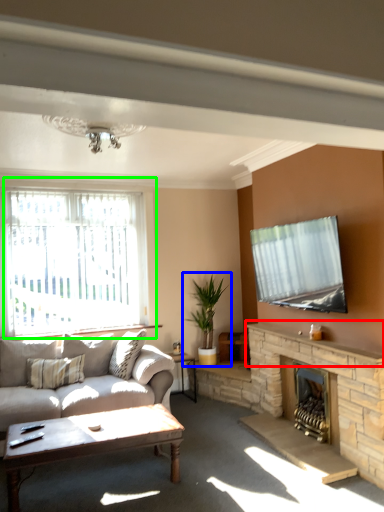
Question: Which object is positioned closest to mantle (highlighted by a red box)? Select from houseplant (highlighted by a blue box) and window (highlighted by a green box).

Choices:
 (A) houseplant
 (B) window

Answer: (A)